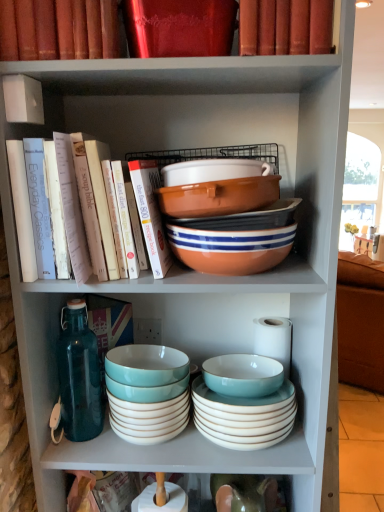
Question: Is there a large distance between matte ceramic bowl at center, the third bowl viewed from the top, and matte ceramic bowl at lower center, which ranks as the sixth bowl in top-to-bottom order?

Choices:
 (A) no
 (B) yes

Answer: (A)

Question: Considering the relative sizes of matte ceramic bowl at center, the third bowl viewed from the top, and matte ceramic bowl at lower center, which ranks as the sixth bowl in top-to-bottom order, in the image provided, is matte ceramic bowl at center, the third bowl viewed from the top, smaller than matte ceramic bowl at lower center, which ranks as the sixth bowl in top-to-bottom order,?

Choices:
 (A) yes
 (B) no

Answer: (A)

Question: Does matte ceramic bowl at center, the fifth bowl positioned from the bottom, have a lesser height compared to matte ceramic bowl at lower center, the 2th bowl from the bottom?

Choices:
 (A) yes
 (B) no

Answer: (A)

Question: Would you say matte ceramic bowl at center, the fifth bowl positioned from the bottom, is outside matte ceramic bowl at lower center, the 2th bowl from the bottom?

Choices:
 (A) yes
 (B) no

Answer: (A)

Question: From the image's perspective, is matte ceramic bowl at center, the fifth bowl positioned from the bottom, located beneath matte ceramic bowl at lower center, the 2th bowl from the bottom?

Choices:
 (A) no
 (B) yes

Answer: (A)

Question: Do you think matte orange bowl at center, which ranks as the sixth bowl in bottom-to-top order, is within matte red book at upper center, placed as the 1th book when sorted from top to bottom, or outside of it?

Choices:
 (A) outside
 (B) inside

Answer: (A)

Question: In the image, is matte orange bowl at center, the second bowl viewed from the top, positioned in front of or behind matte red book at upper center, placed as the 1th book when sorted from top to bottom?

Choices:
 (A) behind
 (B) front

Answer: (A)

Question: Considering the positions of matte orange bowl at center, which ranks as the sixth bowl in bottom-to-top order, and matte red book at upper center, marked as the fourth book in a bottom-to-top arrangement, in the image, is matte orange bowl at center, which ranks as the sixth bowl in bottom-to-top order, taller or shorter than matte red book at upper center, marked as the fourth book in a bottom-to-top arrangement,?

Choices:
 (A) short
 (B) tall

Answer: (A)

Question: From the image's perspective, is matte orange bowl at center, which ranks as the sixth bowl in bottom-to-top order, above or below matte red book at upper center, placed as the 1th book when sorted from top to bottom?

Choices:
 (A) below
 (B) above

Answer: (A)

Question: In terms of height, does matte ceramic bowl at center, the third bowl viewed from the top, look taller or shorter compared to matte orange bowl at center, positioned as the seventh bowl in bottom-to-top order?

Choices:
 (A) tall
 (B) short

Answer: (A)

Question: Looking at their shapes, would you say matte ceramic bowl at center, the fifth bowl positioned from the bottom, is wider or thinner than matte orange bowl at center, positioned as the seventh bowl in bottom-to-top order?

Choices:
 (A) thin
 (B) wide

Answer: (A)

Question: Is matte ceramic bowl at center, the third bowl viewed from the top, inside the boundaries of matte orange bowl at center, which is counted as the first bowl, starting from the top, or outside?

Choices:
 (A) inside
 (B) outside

Answer: (B)

Question: In the image, is matte ceramic bowl at center, the fifth bowl positioned from the bottom, positioned in front of or behind matte orange bowl at center, which is counted as the first bowl, starting from the top?

Choices:
 (A) front
 (B) behind

Answer: (B)

Question: Considering the positions of point (203, 46) and point (89, 158), is point (203, 46) closer or farther from the camera than point (89, 158)?

Choices:
 (A) farther
 (B) closer

Answer: (B)

Question: From the image's perspective, is shiny red book at upper center, acting as the 3th book starting from the top, positioned above or below hardcover books at left, which is counted as the first book, starting from the bottom?

Choices:
 (A) below
 (B) above

Answer: (B)